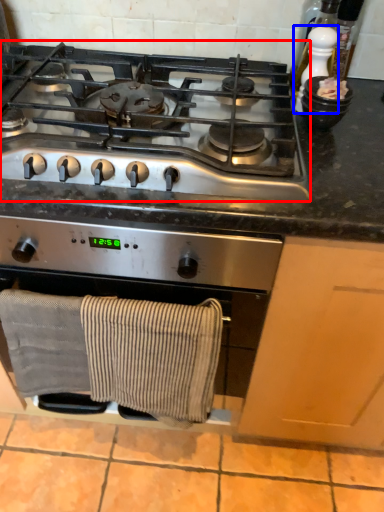
Question: Which object is closer to the camera taking this photo, gas stove (highlighted by a red box) or appliance (highlighted by a blue box)?

Choices:
 (A) gas stove
 (B) appliance

Answer: (A)